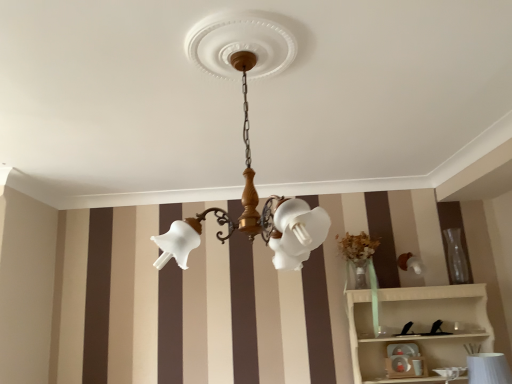
What do you see at coordinates (248, 144) in the screenshot? The height and width of the screenshot is (384, 512). I see `matte white glass chandelier at center` at bounding box center [248, 144].

The image size is (512, 384). Find the location of `transparent glass vase at right`. transparent glass vase at right is located at coordinates (456, 257).

This screenshot has width=512, height=384. What are the coordinates of `white textured vase at lower right` in the screenshot? It's located at (488, 368).

The width and height of the screenshot is (512, 384). What do you see at coordinates (488, 368) in the screenshot?
I see `white textured vase at lower right` at bounding box center [488, 368].

Where is `white wood shelf at lower right`? white wood shelf at lower right is located at coordinates (417, 327).

This screenshot has width=512, height=384. In order to click on matte white glass chandelier at center in this screenshot , I will do `click(248, 144)`.

Does point (408, 374) lie behind point (371, 364)?

No.

How many degrees apart are the facing directions of matte white toy at lower center and white wood shelf at lower right?

1.26 degrees separate the facing orientations of matte white toy at lower center and white wood shelf at lower right.

From the image's perspective, which is above, matte white toy at lower center or white wood shelf at lower right?

white wood shelf at lower right appears higher in the image.

From a real-world perspective, between matte white toy at lower center and white wood shelf at lower right, who is vertically lower?

matte white toy at lower center.

Locate an element on the screen. lamp above the white wood shelf at lower right (from a real-world perspective) is located at coordinates (248, 144).

Is the surface of white wood shelf at lower right in direct contact with matte white glass chandelier at center?

No, white wood shelf at lower right is not touching matte white glass chandelier at center.

Considering the sizes of objects white wood shelf at lower right and matte white glass chandelier at center in the image provided, who is bigger, white wood shelf at lower right or matte white glass chandelier at center?

With larger size is white wood shelf at lower right.

Looking at this image, considering the positions of objects white wood shelf at lower right and matte white glass chandelier at center in the image provided, who is more to the left, white wood shelf at lower right or matte white glass chandelier at center?

matte white glass chandelier at center is more to the left.

Is matte white glass chandelier at center thinner than white wood shelf at lower right?

In fact, matte white glass chandelier at center might be wider than white wood shelf at lower right.

Consider the image. Is matte white glass chandelier at center closer to the viewer compared to white wood shelf at lower right?

Yes, matte white glass chandelier at center is closer to the camera.

How different are the orientations of matte white glass chandelier at center and white wood shelf at lower right in degrees?

There is a 5.33-degree angle between the facing directions of matte white glass chandelier at center and white wood shelf at lower right.

Which point is more distant from viewer, (243,212) or (459,361)?

The point (243,212) is behind.

Does white textured vase at lower right have a smaller size compared to matte white toy at lower center?

No.

Which is more to the left, white textured vase at lower right or matte white toy at lower center?

matte white toy at lower center.

From a real-world perspective, is white textured vase at lower right located beneath matte white toy at lower center?

Correct, in the physical world, white textured vase at lower right is lower than matte white toy at lower center.

From the picture: Could you tell me if white textured vase at lower right is facing matte white toy at lower center?

No, white textured vase at lower right does not turn towards matte white toy at lower center.

How far apart are white wood shelf at lower right and matte white toy at lower center?

21.19 centimeters.

Based on the photo, is matte white toy at lower center a part of white wood shelf at lower right?

Yes, matte white toy at lower center is a part of white wood shelf at lower right.

Looking at the image, does white wood shelf at lower right seem bigger or smaller compared to matte white toy at lower center?

Clearly, white wood shelf at lower right is larger in size than matte white toy at lower center.

In the scene shown: From a real-world perspective, which object rests below the other?

white textured vase at lower right is physically lower.

Does matte white toy at lower center turn towards white textured vase at lower right?

No, matte white toy at lower center is not aimed at white textured vase at lower right.

Is point (396, 372) in front of point (487, 372)?

No, it is not.

From the image's perspective, does transparent glass vase at right appear lower than matte white toy at lower center?

No.

Is transparent glass vase at right facing towards matte white toy at lower center?

No, transparent glass vase at right is not facing towards matte white toy at lower center.

From a real-world perspective, between transparent glass vase at right and matte white toy at lower center, who is vertically lower?

In real-world perspective, matte white toy at lower center is lower.

Is the depth of transparent glass vase at right less than that of matte white toy at lower center?

No, it is behind matte white toy at lower center.

Where is `shelf located above the matte white toy at lower center (from the image's perspective)`? The image size is (512, 384). shelf located above the matte white toy at lower center (from the image's perspective) is located at coordinates (417, 327).

Locate an element on the screen. The width and height of the screenshot is (512, 384). shelf below the matte white glass chandelier at center (from a real-world perspective) is located at coordinates (417, 327).

Estimate the real-world distances between objects in this image. Which object is closer to matte white toy at lower center, transparent glass vase at right or white wood shelf at lower right?

white wood shelf at lower right is closer to matte white toy at lower center.

Estimate the real-world distances between objects in this image. Which object is closer to white wood shelf at lower right, white textured vase at lower right or transparent glass vase at right?

white textured vase at lower right is closer to white wood shelf at lower right.

Looking at the image, which one is located closer to matte white toy at lower center, matte white glass chandelier at center or white textured vase at lower right?

white textured vase at lower right lies closer to matte white toy at lower center than the other object.

Estimate the real-world distances between objects in this image. Which object is closer to white wood shelf at lower right, matte white toy at lower center or transparent glass vase at right?

matte white toy at lower center is positioned closer to the anchor white wood shelf at lower right.

Based on their spatial positions, is white textured vase at lower right or transparent glass vase at right closer to matte white glass chandelier at center?

white textured vase at lower right.

From the image, which object appears to be nearer to matte white glass chandelier at center, white wood shelf at lower right or transparent glass vase at right?

white wood shelf at lower right.

Based on their spatial positions, is matte white toy at lower center or matte white glass chandelier at center closer to white wood shelf at lower right?

matte white toy at lower center.

Considering their positions, is matte white glass chandelier at center positioned closer to matte white toy at lower center than transparent glass vase at right?

The object closer to matte white toy at lower center is transparent glass vase at right.

The height and width of the screenshot is (384, 512). In order to click on shelf between matte white toy at lower center and white textured vase at lower right in this screenshot , I will do (x=417, y=327).

Find the location of a particular element. table lamp located between matte white glass chandelier at center and transparent glass vase at right in the depth direction is located at coordinates (488, 368).

Where is `table lamp between matte white glass chandelier at center and matte white toy at lower center from front to back`? Image resolution: width=512 pixels, height=384 pixels. table lamp between matte white glass chandelier at center and matte white toy at lower center from front to back is located at coordinates (488, 368).

Locate an element on the screen. shelf positioned between matte white glass chandelier at center and matte white toy at lower center from near to far is located at coordinates (417, 327).